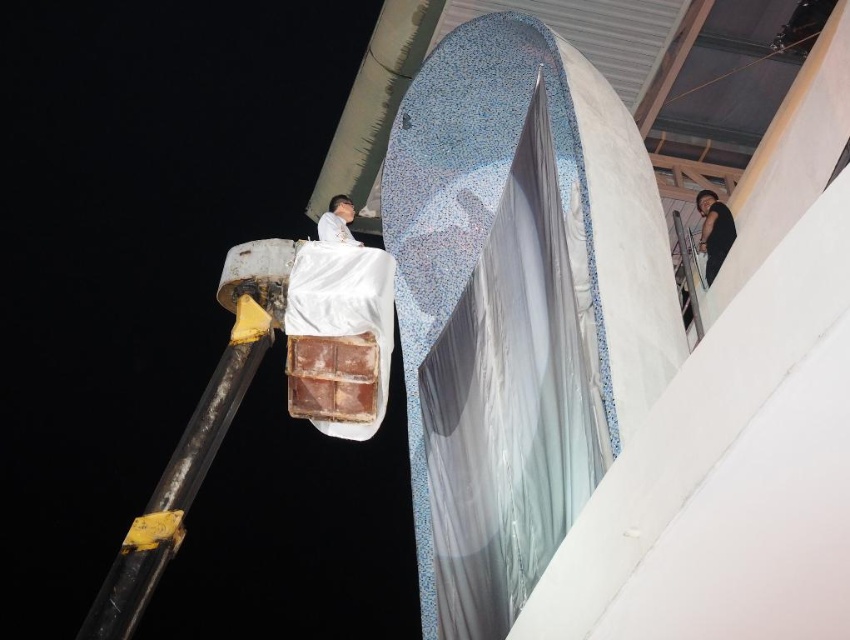
Question: From the image, what is the correct spatial relationship of black matte shirt at upper right in relation to matte white shirt at upper center?

Choices:
 (A) left
 (B) right

Answer: (B)

Question: Which object is farther from the camera taking this photo?

Choices:
 (A) black matte shirt at upper right
 (B) matte white shirt at upper center

Answer: (A)

Question: Which object is closer to the camera taking this photo?

Choices:
 (A) matte white shirt at upper center
 (B) black matte shirt at upper right

Answer: (A)

Question: Can you confirm if black matte shirt at upper right is smaller than matte white shirt at upper center?

Choices:
 (A) yes
 (B) no

Answer: (B)

Question: Does black matte shirt at upper right lie in front of matte white shirt at upper center?

Choices:
 (A) no
 (B) yes

Answer: (A)